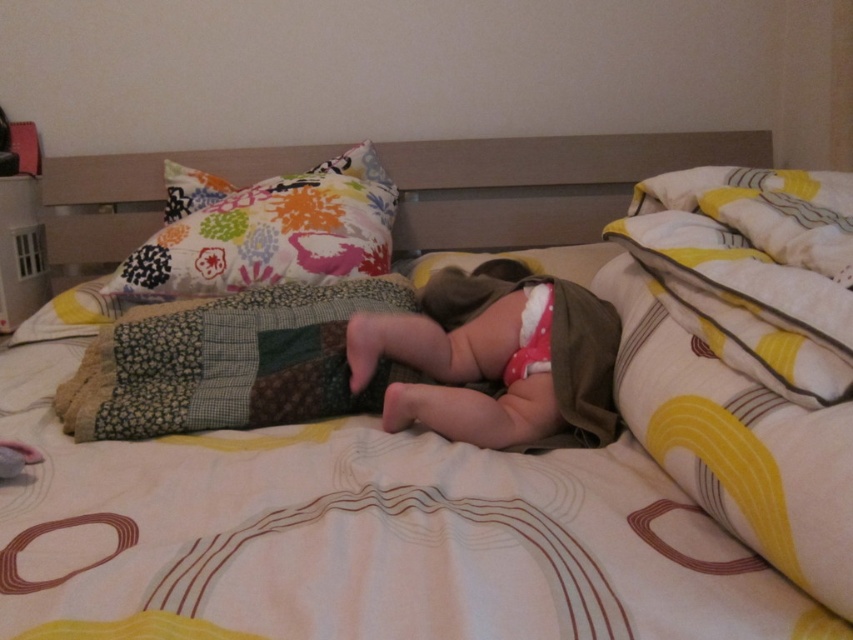
Is multicolored fabric pillow at upper left below white soft diaper at center?

Incorrect, multicolored fabric pillow at upper left is not positioned below white soft diaper at center.

Is multicolored fabric pillow at upper left above white soft diaper at center?

Correct, multicolored fabric pillow at upper left is located above white soft diaper at center.

Is point (207, 264) positioned behind point (526, 371)?

Yes, it is.

This screenshot has width=853, height=640. What are the coordinates of `multicolored fabric pillow at upper left` in the screenshot? It's located at (271, 234).

Does point (421, 369) come closer to viewer compared to point (161, 289)?

Yes.

Who is higher up, pink fabric diaper at center or multicolored fabric pillow at upper left?

Positioned higher is multicolored fabric pillow at upper left.

This screenshot has width=853, height=640. In order to click on pink fabric diaper at center in this screenshot , I will do `click(495, 360)`.

Between point (595, 410) and point (514, 372), which one is positioned in front?

Positioned in front is point (595, 410).

Is pink fabric diaper at center wider than white soft diaper at center?

Yes.

Image resolution: width=853 pixels, height=640 pixels. Describe the element at coordinates (495, 360) in the screenshot. I see `pink fabric diaper at center` at that location.

In order to click on pink fabric diaper at center in this screenshot , I will do `click(495, 360)`.